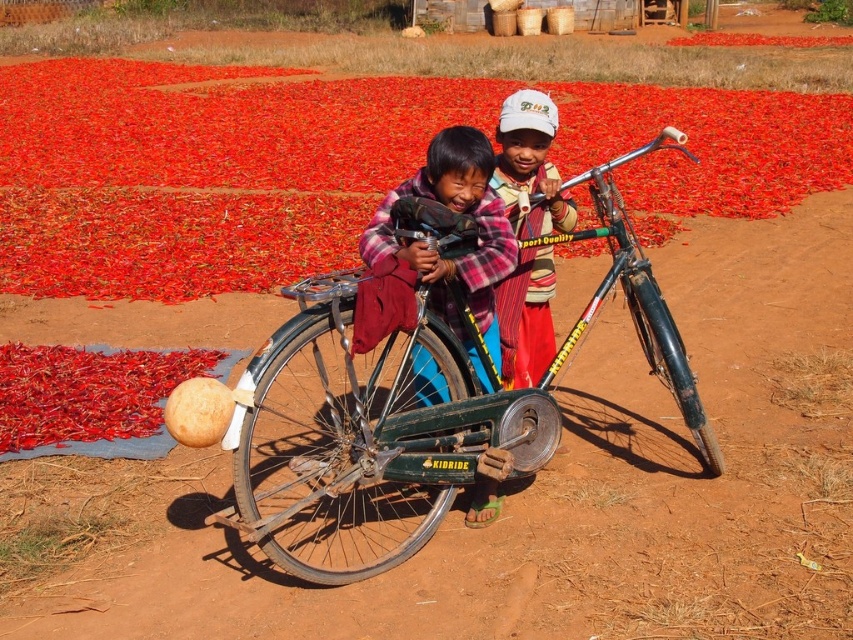
You are a photographer trying to capture a photo of the green matte bicycle at center and the plaid fabric shirt at center. If you want to ensure both are clearly visible in the frame, which object should you focus on first to account for their sizes?

The green matte bicycle at center is bigger than the plaid fabric shirt at center, so you should focus on the green matte bicycle at center first to ensure its details are sharp, as it occupies more space in the frame.

You are a fashion designer observing two shirts in a rural setting. The scene includes a plaid fabric shirt at center and a striped fabric shirt at center. Which shirt do you think is bigger in size?

The plaid fabric shirt at center is larger in size compared to the striped fabric shirt at center.